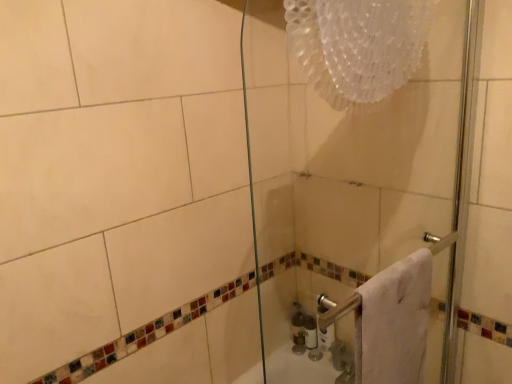
Question: Can you confirm if white glossy bottle at lower center is positioned to the left of transparent glass shower door at center?

Choices:
 (A) yes
 (B) no

Answer: (A)

Question: Considering the relative sizes of white glossy bottle at lower center and transparent glass shower door at center in the image provided, is white glossy bottle at lower center bigger than transparent glass shower door at center?

Choices:
 (A) no
 (B) yes

Answer: (A)

Question: Is transparent glass shower door at center completely or partially inside white glossy bottle at lower center?

Choices:
 (A) no
 (B) yes

Answer: (A)

Question: Can you confirm if white glossy bottle at lower center is thinner than transparent glass shower door at center?

Choices:
 (A) no
 (B) yes

Answer: (B)

Question: From the image's perspective, is white glossy bottle at lower center located beneath transparent glass shower door at center?

Choices:
 (A) yes
 (B) no

Answer: (A)

Question: From a real-world perspective, relative to white glossy bottle at lower center, is white glossy toilet paper at lower right vertically above or below?

Choices:
 (A) below
 (B) above

Answer: (B)

Question: Is white glossy toilet paper at lower right bigger or smaller than white glossy bottle at lower center?

Choices:
 (A) small
 (B) big

Answer: (B)

Question: Looking at their shapes, would you say white glossy toilet paper at lower right is wider or thinner than white glossy bottle at lower center?

Choices:
 (A) thin
 (B) wide

Answer: (A)

Question: Based on their positions, is white glossy toilet paper at lower right located to the left or right of white glossy bottle at lower center?

Choices:
 (A) left
 (B) right

Answer: (B)

Question: In terms of size, does white fluffy towel at right appear bigger or smaller than white glossy bottle at lower center?

Choices:
 (A) big
 (B) small

Answer: (A)

Question: In terms of width, does white fluffy towel at right look wider or thinner when compared to white glossy bottle at lower center?

Choices:
 (A) thin
 (B) wide

Answer: (B)

Question: From a real-world perspective, is white fluffy towel at right positioned above or below white glossy bottle at lower center?

Choices:
 (A) below
 (B) above

Answer: (B)

Question: Is white fluffy towel at right situated inside white glossy bottle at lower center or outside?

Choices:
 (A) outside
 (B) inside

Answer: (A)

Question: Is point (382, 3) closer or farther from the camera than point (311, 319)?

Choices:
 (A) closer
 (B) farther

Answer: (A)

Question: In terms of size, does transparent glass shower door at center appear bigger or smaller than white glossy bottle at lower center?

Choices:
 (A) small
 (B) big

Answer: (B)